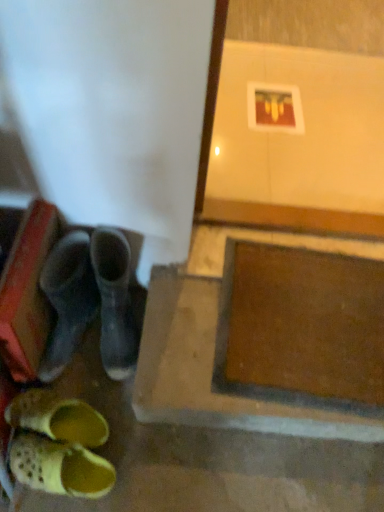
Where is `free spot in front of brown matte concrete at lower right`? The height and width of the screenshot is (512, 384). free spot in front of brown matte concrete at lower right is located at coordinates (242, 473).